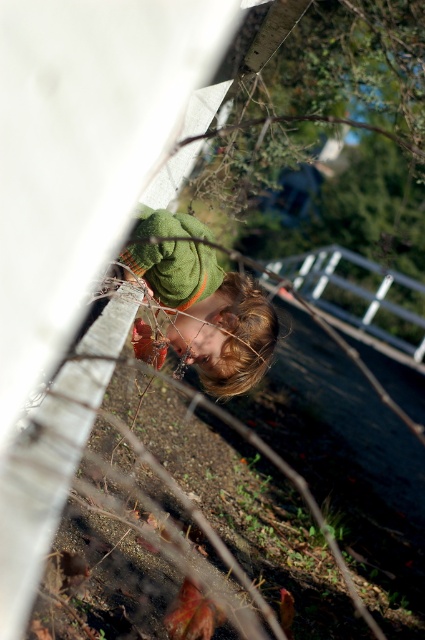
Which is in front, point (221, 324) or point (388, 305)?

Point (221, 324) is in front.

Consider the image. Who is more distant from viewer, (198, 310) or (362, 292)?

Point (362, 292)

The height and width of the screenshot is (640, 425). I want to click on green knitted sweater at upper center, so click(204, 301).